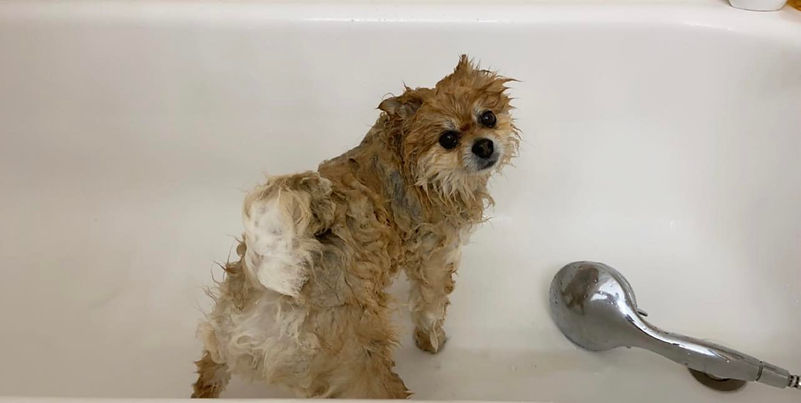
You are a GUI agent. You are given a task and a screenshot of the screen. Output one action in this format:
    pyautogui.click(x=<x>, y=<y>)
    Task: Click on the bathtub
    
    Given the screenshot: What is the action you would take?
    pyautogui.click(x=560, y=212)